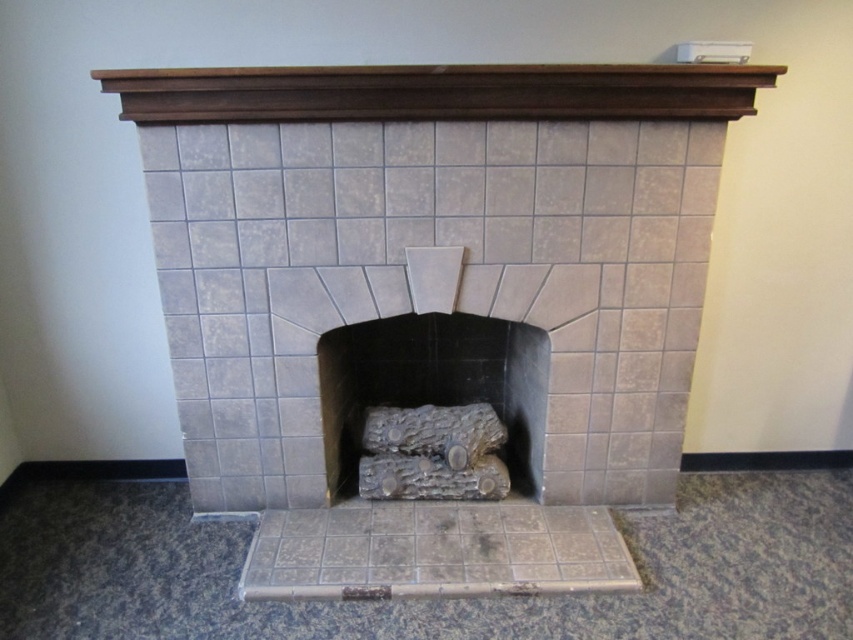
Question: Among these objects, which one is nearest to the camera?

Choices:
 (A) gray tile fireplace at center
 (B) gray stone logs at center

Answer: (A)

Question: Is gray tile fireplace at center closer to the viewer compared to gray stone logs at center?

Choices:
 (A) no
 (B) yes

Answer: (B)

Question: Is gray tile fireplace at center below gray stone logs at center?

Choices:
 (A) no
 (B) yes

Answer: (A)

Question: Which object is closer to the camera taking this photo?

Choices:
 (A) gray stone logs at center
 (B) gray tile fireplace at center

Answer: (B)

Question: Is gray tile fireplace at center below gray stone logs at center?

Choices:
 (A) yes
 (B) no

Answer: (B)